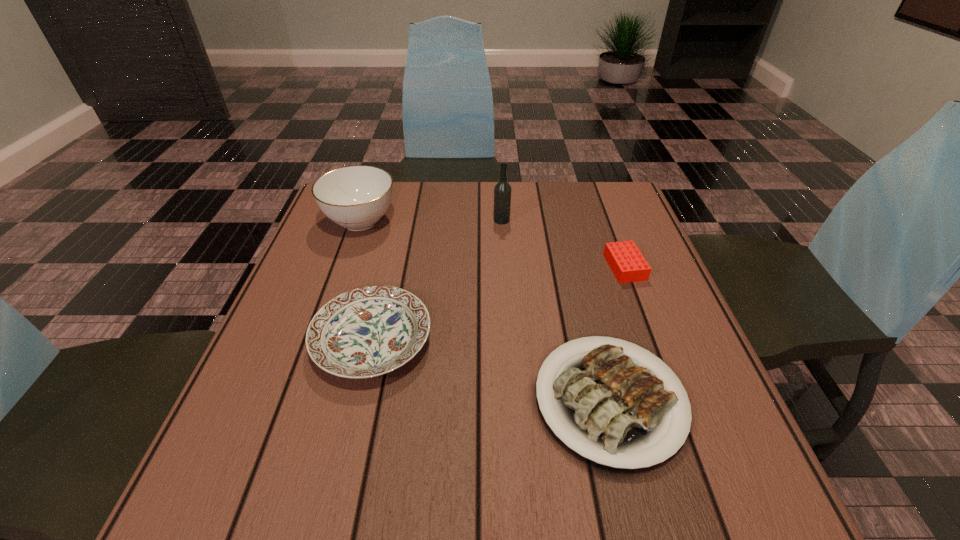
Where is `the tallest object`? the tallest object is located at coordinates (502, 192).

This screenshot has height=540, width=960. Find the location of `the fourth shortest object`. the fourth shortest object is located at coordinates (356, 197).

This screenshot has height=540, width=960. I want to click on Lego, so click(627, 263).

Where is `the left plate`? the left plate is located at coordinates (369, 331).

Find the location of a particular element. The width and height of the screenshot is (960, 540). the right plate is located at coordinates (620, 413).

You are a GUI agent. You are given a task and a screenshot of the screen. Output one action in this format:
    pyautogui.click(x=<x>, y=<y>)
    Task: Click on the vacant point located 0.250m on the left of the vodka
    This screenshot has width=960, height=540.
    Given the screenshot: What is the action you would take?
    pyautogui.click(x=399, y=220)

Find the location of a particular element. Image resolution: width=960 pixels, height=540 pixels. vacant region located 0.150m on the front of the second tallest object is located at coordinates (338, 285).

You are a GUI agent. You are given a task and a screenshot of the screen. Output one action in this format:
    pyautogui.click(x=<x>, y=<y>)
    Task: Click on the vacant space situated 0.220m on the left of the third farthest object
    The height and width of the screenshot is (540, 960).
    Given the screenshot: What is the action you would take?
    pyautogui.click(x=514, y=267)

This screenshot has width=960, height=540. In order to click on free region located 0.330m on the right of the left plate in this screenshot , I will do `click(599, 341)`.

The height and width of the screenshot is (540, 960). Identify the location of free point located 0.070m on the left of the right plate. (483, 400).